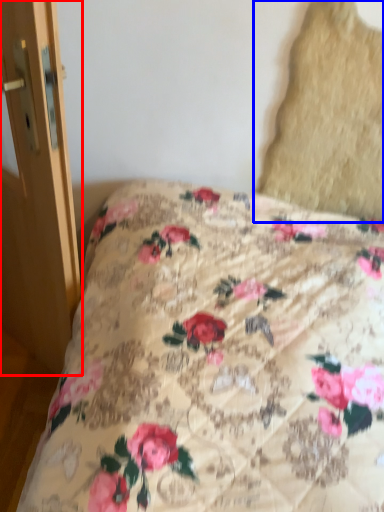
Question: Which point is further to the camera, screen door (highlighted by a red box) or pillow (highlighted by a blue box)?

Choices:
 (A) screen door
 (B) pillow

Answer: (B)